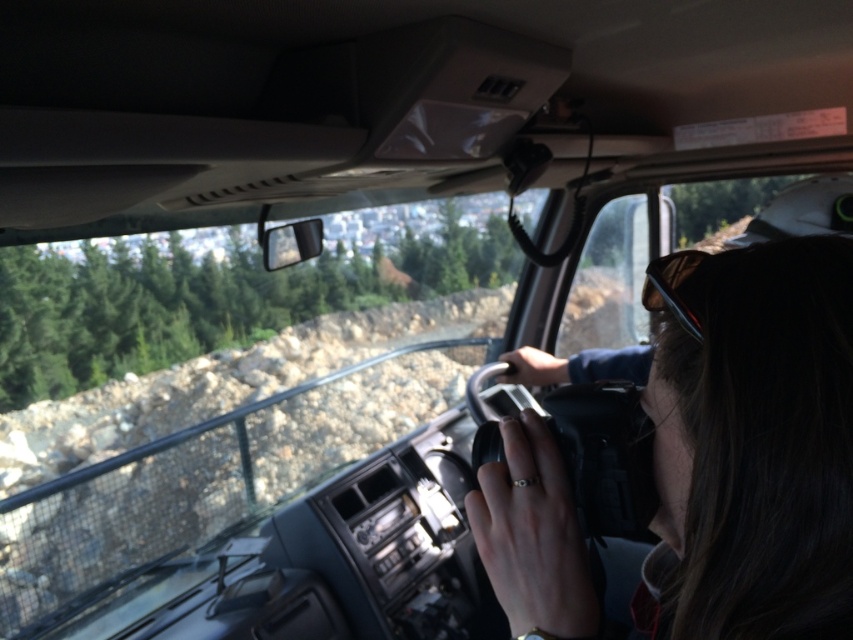
You are a passenger in the vehicle and want to adjust the matte black camera at center. Since you can only reach up to 0.8 meters from your seat, can you reach it based on its position?

The matte black camera at center is located at point (758, 444), which is within your reach since 0.694 is less than 0.8 meters. So yes, you can reach it.

You are a passenger in a truck and want to know if the matte black camera at center can block your view of the sunglasses at center. Based on their sizes, can you determine if the camera is bigger than the sunglasses?

The matte black camera at center is larger in size than sunglasses at center, so yes, the camera is bigger and could potentially block the view of the sunglasses.

You are a passenger in the truck and want to reach the point at coordinates point (x=772, y=554). The camera is mounted at a certain position. If your arm can extend 18 inches, can you reach the point?

The point at coordinates point (x=772, y=554) and the camera are 18.29 inches apart. Since your arm can extend 18 inches, which is slightly shorter than the distance, you cannot reach the point.